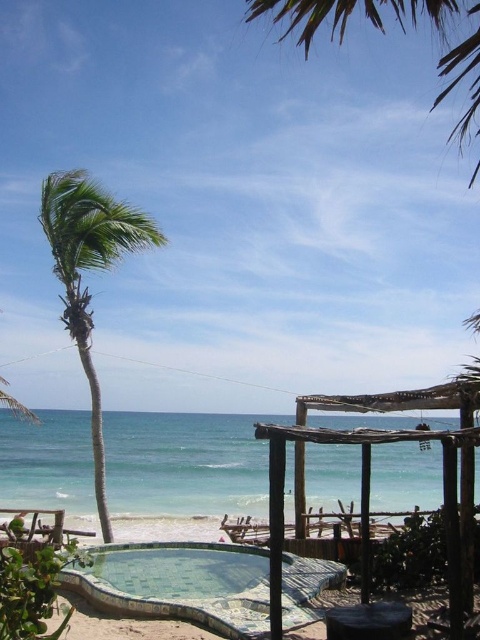
Is point (149, 572) less distant than point (460, 72)?

No, it is not.

Is mosaic tiled pool at center behind green leafy palm tree at upper center?

That is True.

Describe the element at coordinates (179, 584) in the screenshot. This screenshot has width=480, height=640. I see `mosaic tiled pool at center` at that location.

The width and height of the screenshot is (480, 640). What are the coordinates of `mosaic tiled pool at center` in the screenshot? It's located at (179, 584).

Who is higher up, wooden pergola at center or green leafy palm tree at left?

green leafy palm tree at left

Between wooden pergola at center and green leafy palm tree at left, which one has less height?

wooden pergola at center

Between point (460, 497) and point (82, 289), which one is positioned behind?

Point (82, 289)

I want to click on wooden pergola at center, so click(x=370, y=474).

Can you confirm if mosaic tiled pool at center is taller than green leafy palm tree at left?

Incorrect, mosaic tiled pool at center's height is not larger of green leafy palm tree at left's.

Is mosaic tiled pool at center above green leafy palm tree at left?

No, mosaic tiled pool at center is not above green leafy palm tree at left.

Does point (116, 611) come farther from viewer compared to point (79, 218)?

No.

Identify the location of mosaic tiled pool at center. (179, 584).